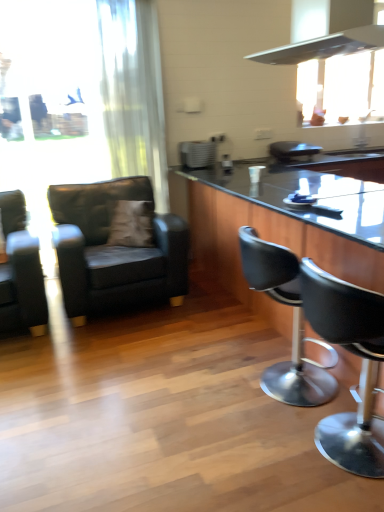
Question: Is metallic silver range hood at upper right thinner than black leather bar stool at center, positioned as the 2th chair in right-to-left order?

Choices:
 (A) yes
 (B) no

Answer: (B)

Question: Can you confirm if metallic silver range hood at upper right is smaller than black leather bar stool at center, positioned as the 2th chair in right-to-left order?

Choices:
 (A) yes
 (B) no

Answer: (B)

Question: Is metallic silver range hood at upper right at the right side of black leather bar stool at center, the third chair from the left?

Choices:
 (A) no
 (B) yes

Answer: (B)

Question: Is black leather bar stool at center, positioned as the 2th chair in right-to-left order, surrounded by metallic silver range hood at upper right?

Choices:
 (A) yes
 (B) no

Answer: (B)

Question: From the image's perspective, is metallic silver range hood at upper right on top of black leather bar stool at center, the third chair from the left?

Choices:
 (A) no
 (B) yes

Answer: (B)

Question: Can we say metallic silver range hood at upper right lies outside black leather bar stool at center, the third chair from the left?

Choices:
 (A) no
 (B) yes

Answer: (B)

Question: Is matte black armchair at left, the 1th chair when ordered from left to right, further to the viewer compared to black leather bar stool at right, which appears as the fourth chair when viewed from the left?

Choices:
 (A) no
 (B) yes

Answer: (B)

Question: Is matte black armchair at left, the 4th chair when ordered from right to left, located outside black leather bar stool at right, which appears as the fourth chair when viewed from the left?

Choices:
 (A) no
 (B) yes

Answer: (B)

Question: Is black leather bar stool at right, marked as the first chair in a right-to-left arrangement, a part of matte black armchair at left, the 4th chair when ordered from right to left?

Choices:
 (A) yes
 (B) no

Answer: (B)

Question: Can you confirm if matte black armchair at left, the 4th chair when ordered from right to left, is bigger than black leather bar stool at right, marked as the first chair in a right-to-left arrangement?

Choices:
 (A) no
 (B) yes

Answer: (B)

Question: Does matte black armchair at left, the 1th chair when ordered from left to right, have a greater width compared to black leather bar stool at right, which appears as the fourth chair when viewed from the left?

Choices:
 (A) no
 (B) yes

Answer: (B)

Question: From the image's perspective, is matte black armchair at left, the 1th chair when ordered from left to right, above black leather bar stool at right, which appears as the fourth chair when viewed from the left?

Choices:
 (A) no
 (B) yes

Answer: (B)

Question: Is brown suede pillow at center located outside matte black armchair at left, marked as the 3th chair in a right-to-left arrangement?

Choices:
 (A) no
 (B) yes

Answer: (A)